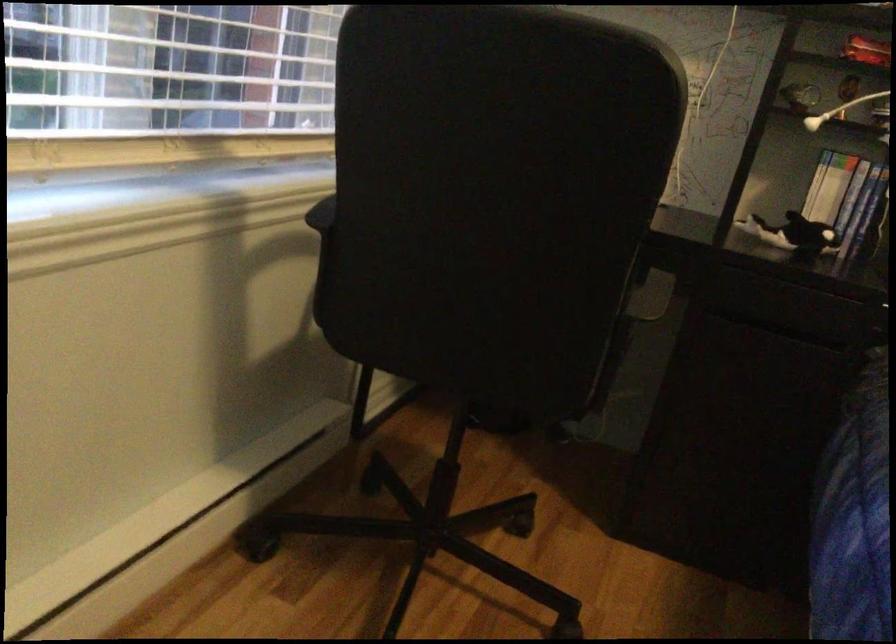
Find where to pull the blue book spine. Please return your answer as a coordinate pair (x, y).

(853, 518)